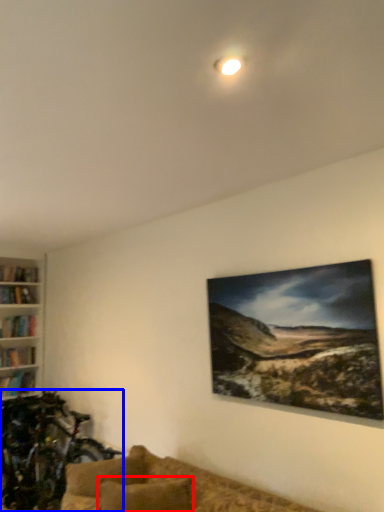
Question: Among these objects, which one is nearest to the camera, pillow (highlighted by a red box) or mountain bike (highlighted by a blue box)?

Choices:
 (A) pillow
 (B) mountain bike

Answer: (A)